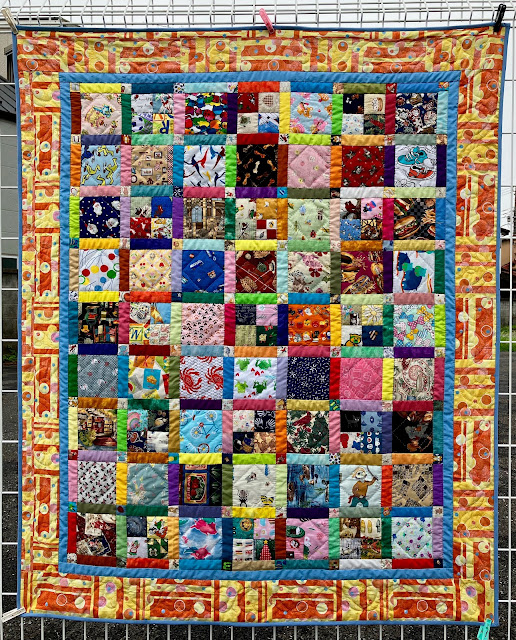
Find the location of `quilt`. quilt is located at coordinates (474, 385).